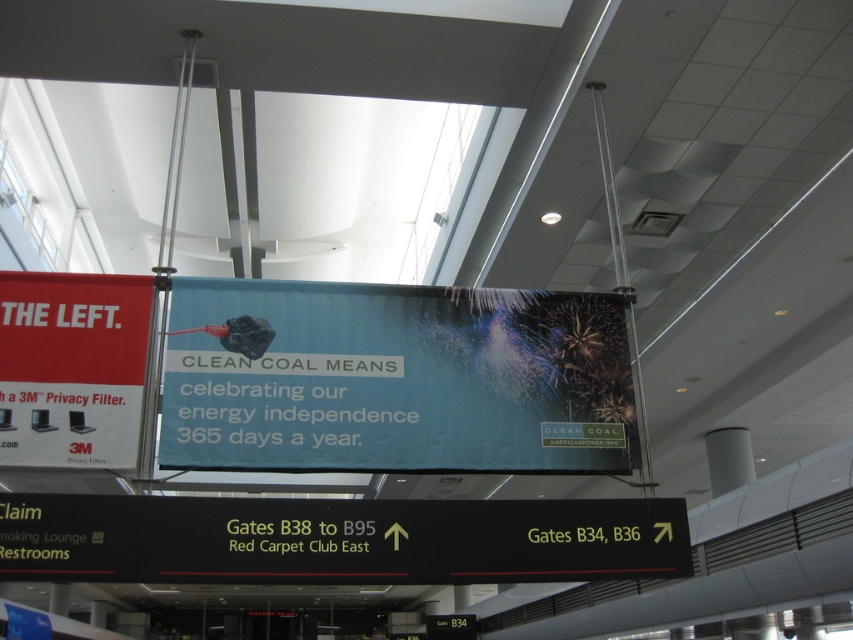
You are standing in the airport terminal and need to locate the blue fabric billboard at center. According to the scene description, where should you look to find it?

The blue fabric billboard at center is located at point 0.594 on the x axis and 0.464 on the y axis.

From the picture: You are a traveler at the airport terminal. You see a black matte sign at lower center and a matte red banner at left. Which one is wider?

The black matte sign at lower center is wider than the matte red banner at left.